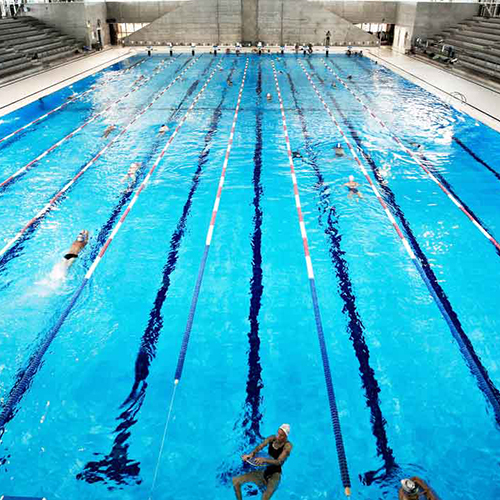
The height and width of the screenshot is (500, 500). Identify the location of wall. (215, 26).